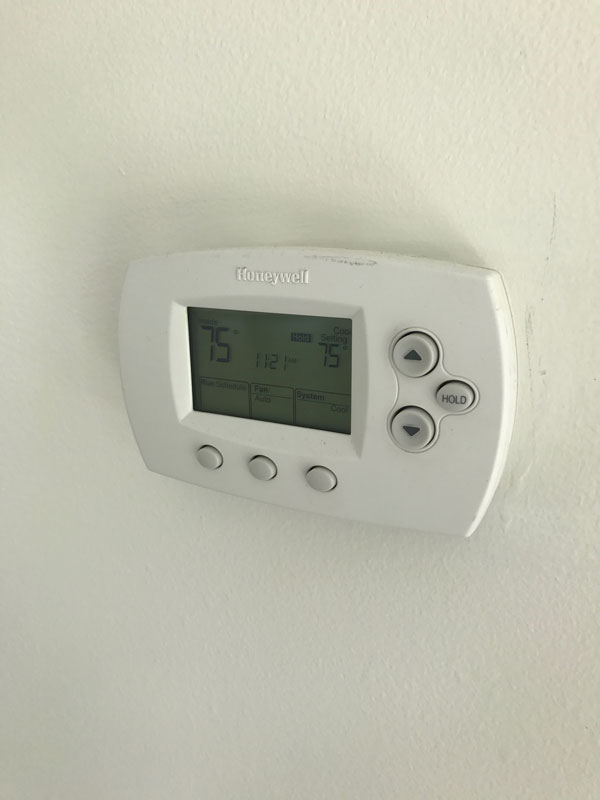
Find the location of `marks on wall`. marks on wall is located at coordinates (528, 328).